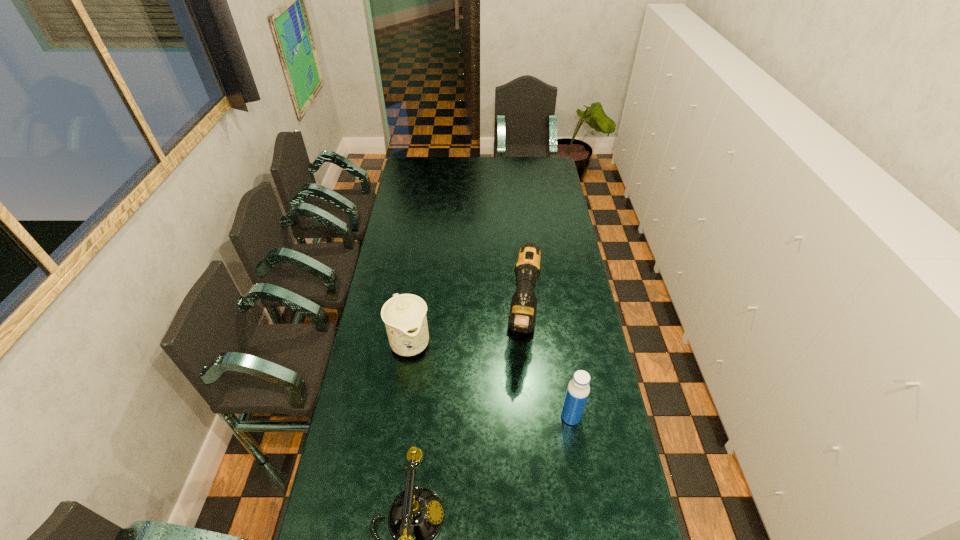
Identify the location of unoccupied area between the second object from right to left and the chinaware. (467, 334).

Find the location of `vacant area that lies between the drill and the chinaware`. vacant area that lies between the drill and the chinaware is located at coordinates (467, 334).

In order to click on unoccupied position between the third farthest object and the third object from left to right in this screenshot , I will do `click(547, 372)`.

The height and width of the screenshot is (540, 960). Identify the location of vacant space that is in between the water bottle and the chinaware. (491, 379).

Identify the location of object that ranks as the third closest to the drill. [x=415, y=518].

At what (x,y) coordinates should I click in order to perform the action: click on object that stands as the second closest to the chinaware. Please return your answer as a coordinate pair (x, y). The image size is (960, 540). Looking at the image, I should click on (415, 518).

The width and height of the screenshot is (960, 540). In order to click on free point that satisfies the following two spatial constraints: 1. on the front side of the chinaware; 2. on the left side of the water bottle in this screenshot , I will do `click(400, 416)`.